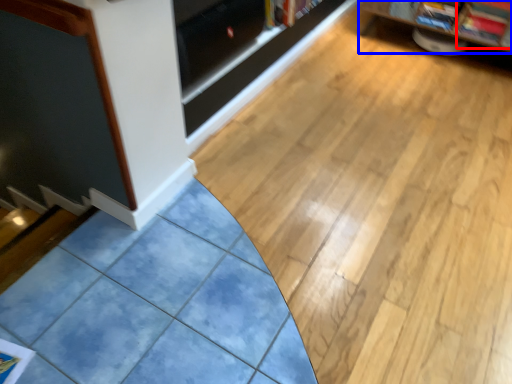
Question: Which of the following is the farthest to the observer, magazine (highlighted by a red box) or shelf (highlighted by a blue box)?

Choices:
 (A) magazine
 (B) shelf

Answer: (A)